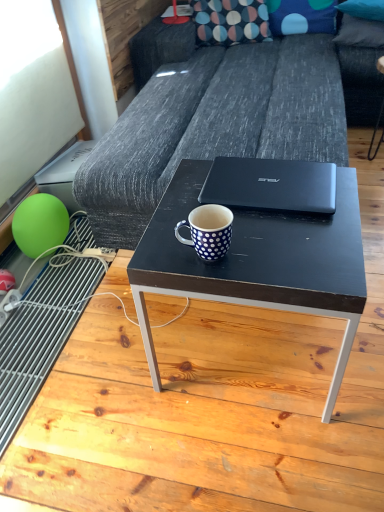
Image resolution: width=384 pixels, height=512 pixels. Identify the location of free space in front of blue dotted mug at center. (216, 272).